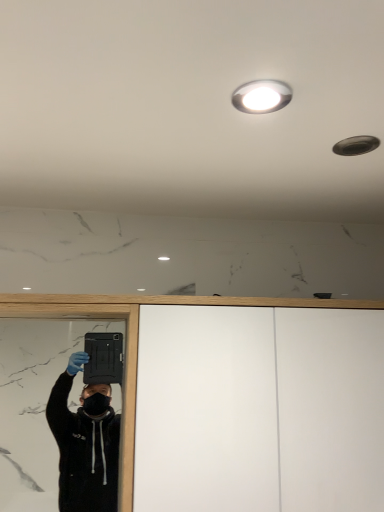
This screenshot has width=384, height=512. Identify the location of white glossy droplight at upper center. (261, 96).

Describe the element at coordinates (261, 96) in the screenshot. I see `white glossy droplight at upper center` at that location.

Locate an element on the screen. white matte dresser at center is located at coordinates click(x=137, y=340).

This screenshot has width=384, height=512. What do you see at coordinates (137, 340) in the screenshot?
I see `white matte dresser at center` at bounding box center [137, 340].

At what (x,y) coordinates should I click in order to perform the action: click on white glossy droplight at upper center. Please return your answer as a coordinate pair (x, y). The image size is (384, 512). Looking at the image, I should click on (261, 96).

Does white matte dresser at center appear on the right side of white glossy droplight at upper center?

Yes.

Which object is closer to the camera taking this photo, white matte dresser at center or white glossy droplight at upper center?

Positioned in front is white glossy droplight at upper center.

Considering the positions of point (37, 298) and point (264, 81), is point (37, 298) closer or farther from the camera than point (264, 81)?

Clearly, point (37, 298) is more distant from the camera than point (264, 81).

From the image's perspective, is white matte dresser at center over white glossy droplight at upper center?

Incorrect, from the image's perspective, white matte dresser at center is lower than white glossy droplight at upper center.

From a real-world perspective, who is located lower, white matte dresser at center or white glossy droplight at upper center?

white matte dresser at center is physically lower.

Considering the sizes of white matte dresser at center and white glossy droplight at upper center in the image, is white matte dresser at center wider or thinner than white glossy droplight at upper center?

Clearly, white matte dresser at center has more width compared to white glossy droplight at upper center.

Is white matte dresser at center taller than white glossy droplight at upper center?

Yes.

Is white matte dresser at center bigger or smaller than white glossy droplight at upper center?

Clearly, white matte dresser at center is larger in size than white glossy droplight at upper center.

Is white glossy droplight at upper center inside white matte dresser at center?

No.

Is white matte dresser at center placed right next to white glossy droplight at upper center?

No.

Is white glossy droplight at upper center at the back of white matte dresser at center?

white matte dresser at center does not have its back to white glossy droplight at upper center.

How many degrees apart are the facing directions of white matte dresser at center and white glossy droplight at upper center?

The facing directions of white matte dresser at center and white glossy droplight at upper center are 1.67 degrees apart.

The image size is (384, 512). Find the location of `droplight that is above the white matte dresser at center (from a real-world perspective)`. droplight that is above the white matte dresser at center (from a real-world perspective) is located at coordinates (261, 96).

Between white glossy droplight at upper center and white matte dresser at center, which one appears on the left side from the viewer's perspective?

From the viewer's perspective, white glossy droplight at upper center appears more on the left side.

Which is behind, white glossy droplight at upper center or white matte dresser at center?

white matte dresser at center is more distant.

Is point (254, 102) positioned after point (282, 303)?

No, (254, 102) is in front of (282, 303).

From the image's perspective, is white glossy droplight at upper center located above or below white matte dresser at center?

Based on their image positions, white glossy droplight at upper center is located above white matte dresser at center.

From a real-world perspective, which object stands above the other?

In real-world perspective, white glossy droplight at upper center is above.

Can you confirm if white glossy droplight at upper center is thinner than white matte dresser at center?

Yes, white glossy droplight at upper center is thinner than white matte dresser at center.

Between white glossy droplight at upper center and white matte dresser at center, which one has more height?

white matte dresser at center is taller.

Which of these two, white glossy droplight at upper center or white matte dresser at center, is smaller?

Smaller between the two is white glossy droplight at upper center.

From the picture: Is white matte dresser at center surrounded by white glossy droplight at upper center?

Definitely not — white matte dresser at center is not inside white glossy droplight at upper center.

Is white glossy droplight at upper center next to white matte dresser at center and touching it?

No, white glossy droplight at upper center is not in contact with white matte dresser at center.

Is white glossy droplight at upper center positioned with its back to white matte dresser at center?

white glossy droplight at upper center is not turned away from white matte dresser at center.

How different are the orientations of white glossy droplight at upper center and white matte dresser at center in degrees?

The angle between the facing direction of white glossy droplight at upper center and the facing direction of white matte dresser at center is 1.67 degrees.

How far apart are white glossy droplight at upper center and white matte dresser at center?

white glossy droplight at upper center and white matte dresser at center are 21.07 inches apart from each other.

Find the location of a particular element. droplight lying above the white matte dresser at center (from the image's perspective) is located at coordinates (261, 96).

Identify the location of dresser that appears below the white glossy droplight at upper center (from the image's perspective). This screenshot has height=512, width=384. (137, 340).

Identify the location of droplight located on the left of white matte dresser at center. This screenshot has width=384, height=512. (261, 96).